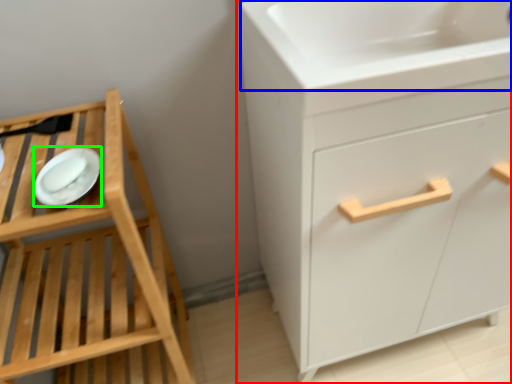
Question: Estimate the real-world distances between objects in this image. Which object is closer to chest of drawers (highlighted by a red box), sink (highlighted by a blue box) or platter (highlighted by a green box)?

Choices:
 (A) sink
 (B) platter

Answer: (A)